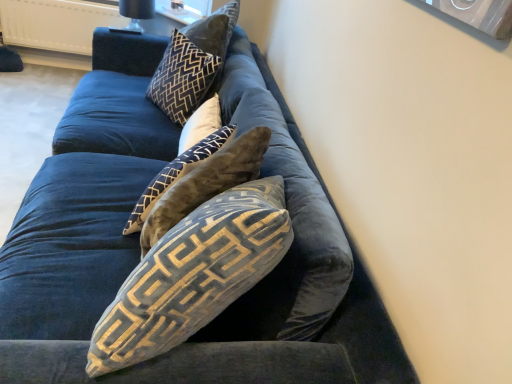
The width and height of the screenshot is (512, 384). Describe the element at coordinates (134, 14) in the screenshot. I see `black glass lamp at upper center` at that location.

What do you see at coordinates (193, 64) in the screenshot? The height and width of the screenshot is (384, 512). I see `velvet black pillow at upper center, the first pillow in the back-to-front sequence` at bounding box center [193, 64].

Find the location of a particular element. This screenshot has height=384, width=512. velvet brown pillow at center, which appears as the second pillow when viewed from the back is located at coordinates (201, 124).

What is the approximate width of velvet gold-patterned pillow at center, acting as the 1th pillow starting from the front?

velvet gold-patterned pillow at center, acting as the 1th pillow starting from the front, is 13.02 inches in width.

This screenshot has width=512, height=384. Identify the location of black glass lamp at upper center. (134, 14).

Is velvet beige pillow at center, the third pillow in the back-to-front sequence, not near velvet gold-patterned pillow at center, positioned as the fourth pillow in back-to-front order?

No, velvet beige pillow at center, the third pillow in the back-to-front sequence, is not far away from velvet gold-patterned pillow at center, positioned as the fourth pillow in back-to-front order.

From a real-world perspective, is velvet beige pillow at center, the third pillow in the back-to-front sequence, above or below velvet gold-patterned pillow at center, positioned as the fourth pillow in back-to-front order?

In terms of real-world spatial position, velvet beige pillow at center, the third pillow in the back-to-front sequence, is below velvet gold-patterned pillow at center, positioned as the fourth pillow in back-to-front order.

At what (x,y) coordinates should I click in order to perform the action: click on the 2nd pillow to the left of the velvet gold-patterned pillow at center, acting as the 1th pillow starting from the front, starting your count from the anchor. Please return your answer as a coordinate pair (x, y). Looking at the image, I should click on (184, 158).

From their relative heights in the image, would you say velvet beige pillow at center, which is the second pillow in front-to-back order, is taller or shorter than velvet gold-patterned pillow at center, acting as the 1th pillow starting from the front?

velvet beige pillow at center, which is the second pillow in front-to-back order, is shorter than velvet gold-patterned pillow at center, acting as the 1th pillow starting from the front.

Between velvet beige pillow at center, the third pillow in the back-to-front sequence, and velvet black pillow at upper center, the first pillow in the back-to-front sequence, which one appears on the left side from the viewer's perspective?

Positioned to the left is velvet black pillow at upper center, the first pillow in the back-to-front sequence.

Between velvet beige pillow at center, which is the second pillow in front-to-back order, and velvet black pillow at upper center, which is counted as the fourth pillow, starting from the front, which one has larger size?

With larger size is velvet black pillow at upper center, which is counted as the fourth pillow, starting from the front.

Is velvet black pillow at upper center, which is counted as the fourth pillow, starting from the front, surrounded by velvet beige pillow at center, the third pillow in the back-to-front sequence?

That's incorrect, velvet black pillow at upper center, which is counted as the fourth pillow, starting from the front, is not inside velvet beige pillow at center, the third pillow in the back-to-front sequence.

Can you tell me how much velvet beige pillow at center, which is the second pillow in front-to-back order, and velvet black pillow at upper center, the first pillow in the back-to-front sequence, differ in facing direction?

There is a 0.0123-degree angle between the facing directions of velvet beige pillow at center, which is the second pillow in front-to-back order, and velvet black pillow at upper center, the first pillow in the back-to-front sequence.

From the image's perspective, is velvet black pillow at upper center, which is counted as the fourth pillow, starting from the front, over black glass lamp at upper center?

No, from the image's perspective, velvet black pillow at upper center, which is counted as the fourth pillow, starting from the front, is not on top of black glass lamp at upper center.

There is a black glass lamp at upper center. At what (x,y) coordinates should I click in order to perform the action: click on the 1st pillow above it (from a real-world perspective). Please return your answer as a coordinate pair (x, y). This screenshot has height=384, width=512. Looking at the image, I should click on (193, 64).

What's the angular difference between velvet black pillow at upper center, which is counted as the fourth pillow, starting from the front, and black glass lamp at upper center's facing directions?

The angular difference between velvet black pillow at upper center, which is counted as the fourth pillow, starting from the front, and black glass lamp at upper center is 5.34 degrees.

Does velvet black pillow at upper center, which is counted as the fourth pillow, starting from the front, lie behind black glass lamp at upper center?

No, it is in front of black glass lamp at upper center.

Is velvet black pillow at upper center, the first pillow in the back-to-front sequence, situated inside velvet gold-patterned pillow at center, acting as the 1th pillow starting from the front, or outside?

velvet black pillow at upper center, the first pillow in the back-to-front sequence, is spatially situated outside velvet gold-patterned pillow at center, acting as the 1th pillow starting from the front.

From a real-world perspective, is velvet black pillow at upper center, which is counted as the fourth pillow, starting from the front, physically located above or below velvet gold-patterned pillow at center, acting as the 1th pillow starting from the front?

velvet black pillow at upper center, which is counted as the fourth pillow, starting from the front, is below velvet gold-patterned pillow at center, acting as the 1th pillow starting from the front.

Who is shorter, velvet black pillow at upper center, which is counted as the fourth pillow, starting from the front, or velvet gold-patterned pillow at center, acting as the 1th pillow starting from the front?

velvet gold-patterned pillow at center, acting as the 1th pillow starting from the front, is shorter.

Considering the relative positions of velvet black pillow at upper center, the first pillow in the back-to-front sequence, and velvet gold-patterned pillow at center, acting as the 1th pillow starting from the front, in the image provided, is velvet black pillow at upper center, the first pillow in the back-to-front sequence, to the right of velvet gold-patterned pillow at center, acting as the 1th pillow starting from the front, from the viewer's perspective?

In fact, velvet black pillow at upper center, the first pillow in the back-to-front sequence, is to the left of velvet gold-patterned pillow at center, acting as the 1th pillow starting from the front.

Is velvet beige pillow at center, the third pillow in the back-to-front sequence, inside or outside of velvet brown pillow at center, which appears as the second pillow when viewed from the back?

velvet beige pillow at center, the third pillow in the back-to-front sequence, is located beyond the bounds of velvet brown pillow at center, which appears as the second pillow when viewed from the back.

Image resolution: width=512 pixels, height=384 pixels. Find the location of `pillow that is the 1st object above the velvet brown pillow at center, which appears as the second pillow when viewed from the back (from a real-world perspective)`. pillow that is the 1st object above the velvet brown pillow at center, which appears as the second pillow when viewed from the back (from a real-world perspective) is located at coordinates (184, 158).

Which is in front, velvet beige pillow at center, the third pillow in the back-to-front sequence, or velvet brown pillow at center, the 3th pillow when ordered from front to back?

velvet beige pillow at center, the third pillow in the back-to-front sequence, is closer to the camera.

Is velvet beige pillow at center, the third pillow in the back-to-front sequence, situated inside black glass lamp at upper center or outside?

velvet beige pillow at center, the third pillow in the back-to-front sequence, is not enclosed by black glass lamp at upper center.

From a real-world perspective, is velvet beige pillow at center, the third pillow in the back-to-front sequence, under black glass lamp at upper center?

Yes.

Considering the points (205, 117) and (141, 4), which point is in front, point (205, 117) or point (141, 4)?

The point (205, 117) is more forward.

Considering the relative positions of velvet beige pillow at center, the third pillow in the back-to-front sequence, and black glass lamp at upper center in the image provided, is velvet beige pillow at center, the third pillow in the back-to-front sequence, behind black glass lamp at upper center?

That is False.

Is velvet brown pillow at center, which appears as the second pillow when viewed from the back, oriented towards velvet black pillow at upper center, the first pillow in the back-to-front sequence?

No.

Between velvet brown pillow at center, the 3th pillow when ordered from front to back, and velvet black pillow at upper center, the first pillow in the back-to-front sequence, which one has less height?

velvet brown pillow at center, the 3th pillow when ordered from front to back.

Which of these two, velvet brown pillow at center, which appears as the second pillow when viewed from the back, or velvet black pillow at upper center, which is counted as the fourth pillow, starting from the front, is smaller?

Smaller between the two is velvet brown pillow at center, which appears as the second pillow when viewed from the back.

Considering the sizes of objects velvet brown pillow at center, the 3th pillow when ordered from front to back, and velvet black pillow at upper center, the first pillow in the back-to-front sequence, in the image provided, who is thinner, velvet brown pillow at center, the 3th pillow when ordered from front to back, or velvet black pillow at upper center, the first pillow in the back-to-front sequence,?

velvet brown pillow at center, the 3th pillow when ordered from front to back, is thinner.

This screenshot has height=384, width=512. I want to click on the 1st pillow above the velvet gold-patterned pillow at center, positioned as the fourth pillow in back-to-front order (from the image's perspective), so click(x=184, y=158).

Image resolution: width=512 pixels, height=384 pixels. I want to click on the 2nd pillow in front of the velvet black pillow at upper center, the first pillow in the back-to-front sequence, so click(x=184, y=158).

Based on their spatial positions, is velvet black pillow at upper center, which is counted as the fourth pillow, starting from the front, or velvet beige pillow at center, the third pillow in the back-to-front sequence, closer to velvet gold-patterned pillow at center, acting as the 1th pillow starting from the front?

velvet beige pillow at center, the third pillow in the back-to-front sequence, is closer to velvet gold-patterned pillow at center, acting as the 1th pillow starting from the front.

From the image, which object appears to be nearer to velvet beige pillow at center, which is the second pillow in front-to-back order, velvet gold-patterned pillow at center, acting as the 1th pillow starting from the front, or black glass lamp at upper center?

velvet gold-patterned pillow at center, acting as the 1th pillow starting from the front, is positioned closer to the anchor velvet beige pillow at center, which is the second pillow in front-to-back order.

Estimate the real-world distances between objects in this image. Which object is further from velvet gold-patterned pillow at center, positioned as the fourth pillow in back-to-front order, black glass lamp at upper center or velvet brown pillow at center, which appears as the second pillow when viewed from the back?

black glass lamp at upper center is positioned further to the anchor velvet gold-patterned pillow at center, positioned as the fourth pillow in back-to-front order.

When comparing their distances from black glass lamp at upper center, does velvet gold-patterned pillow at center, positioned as the fourth pillow in back-to-front order, or velvet brown pillow at center, the 3th pillow when ordered from front to back, seem further?

velvet gold-patterned pillow at center, positioned as the fourth pillow in back-to-front order, is positioned further to the anchor black glass lamp at upper center.

Considering their positions, is velvet gold-patterned pillow at center, acting as the 1th pillow starting from the front, positioned further to black glass lamp at upper center than velvet black pillow at upper center, which is counted as the fourth pillow, starting from the front?

velvet gold-patterned pillow at center, acting as the 1th pillow starting from the front, is positioned further to the anchor black glass lamp at upper center.

Estimate the real-world distances between objects in this image. Which object is closer to velvet beige pillow at center, the third pillow in the back-to-front sequence, velvet gold-patterned pillow at center, acting as the 1th pillow starting from the front, or velvet black pillow at upper center, which is counted as the fourth pillow, starting from the front?

Based on the image, velvet gold-patterned pillow at center, acting as the 1th pillow starting from the front, appears to be nearer to velvet beige pillow at center, the third pillow in the back-to-front sequence.

Estimate the real-world distances between objects in this image. Which object is further from velvet beige pillow at center, the third pillow in the back-to-front sequence, black glass lamp at upper center or velvet gold-patterned pillow at center, positioned as the fourth pillow in back-to-front order?

Based on the image, black glass lamp at upper center appears to be further to velvet beige pillow at center, the third pillow in the back-to-front sequence.

Estimate the real-world distances between objects in this image. Which object is further from velvet brown pillow at center, which appears as the second pillow when viewed from the back, velvet gold-patterned pillow at center, positioned as the fourth pillow in back-to-front order, or velvet black pillow at upper center, which is counted as the fourth pillow, starting from the front?

velvet gold-patterned pillow at center, positioned as the fourth pillow in back-to-front order, lies further to velvet brown pillow at center, which appears as the second pillow when viewed from the back, than the other object.

The height and width of the screenshot is (384, 512). In order to click on pillow between velvet gold-patterned pillow at center, positioned as the fourth pillow in back-to-front order, and velvet brown pillow at center, which appears as the second pillow when viewed from the back, along the z-axis in this screenshot , I will do (x=184, y=158).

This screenshot has height=384, width=512. In order to click on pillow between velvet beige pillow at center, the third pillow in the back-to-front sequence, and velvet black pillow at upper center, the first pillow in the back-to-front sequence, along the z-axis in this screenshot , I will do `click(201, 124)`.

The width and height of the screenshot is (512, 384). Find the location of `pillow between velvet brown pillow at center, the 3th pillow when ordered from front to back, and black glass lamp at upper center, along the z-axis`. pillow between velvet brown pillow at center, the 3th pillow when ordered from front to back, and black glass lamp at upper center, along the z-axis is located at coordinates (193, 64).